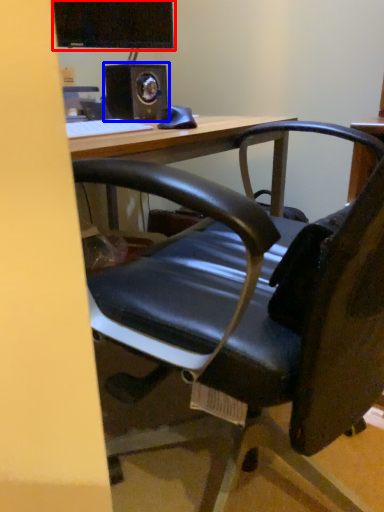
Question: Which object appears closest to the camera in this image, computer monitor (highlighted by a red box) or speaker (highlighted by a blue box)?

Choices:
 (A) computer monitor
 (B) speaker

Answer: (B)